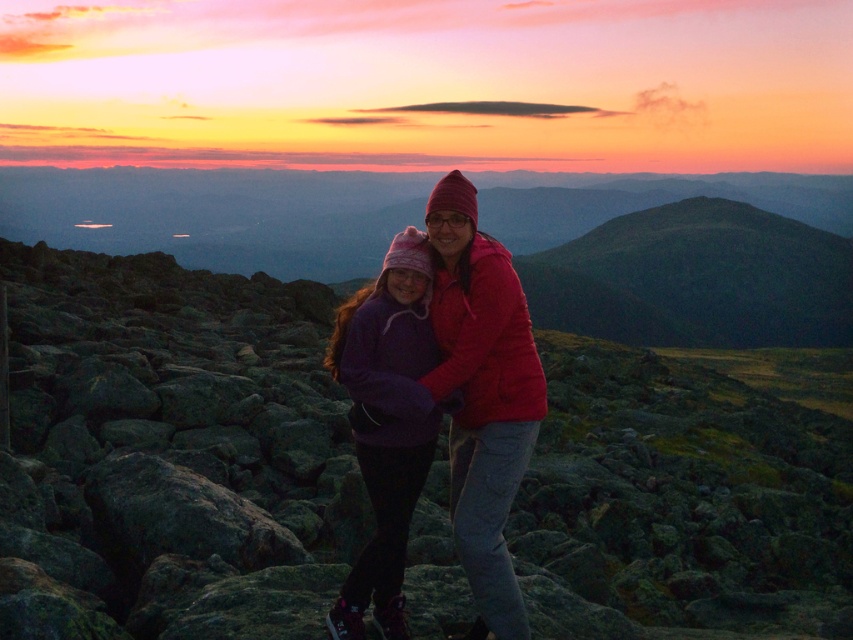
Question: Is rocky terrain at center wider than matte pink hat at center?

Choices:
 (A) no
 (B) yes

Answer: (B)

Question: Which object is positioned farthest from the matte pink hat at center?

Choices:
 (A) rocky terrain at center
 (B) green grassy hill at center

Answer: (B)

Question: Where is rocky terrain at center located in relation to green grassy hill at center in the image?

Choices:
 (A) right
 (B) left

Answer: (B)

Question: Which point appears farthest from the camera in this image?

Choices:
 (A) (683, 515)
 (B) (786, 266)

Answer: (B)

Question: Which of the following is the farthest from the observer?

Choices:
 (A) (625, 280)
 (B) (610, 349)

Answer: (A)

Question: Can you confirm if green grassy hill at center is thinner than matte pink hat at center?

Choices:
 (A) yes
 (B) no

Answer: (B)